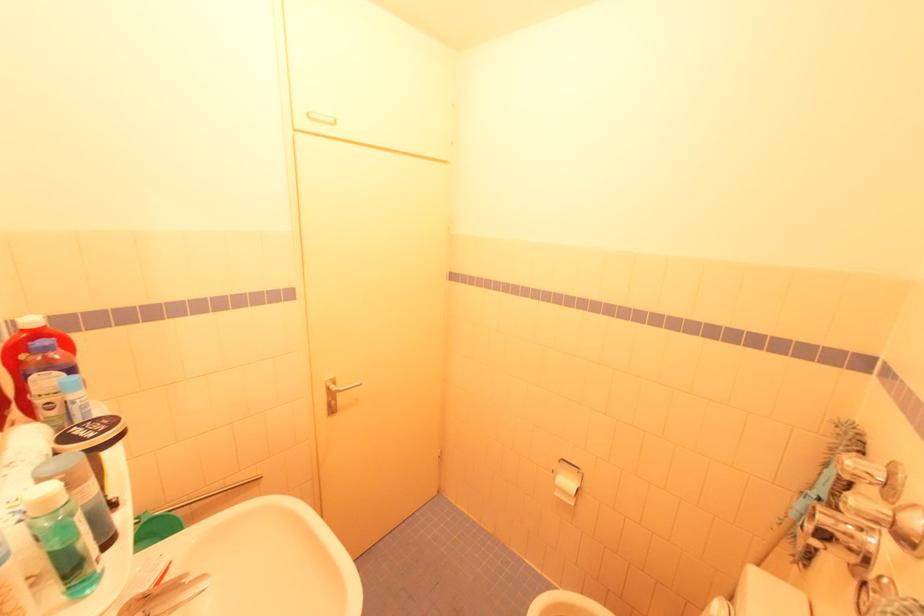
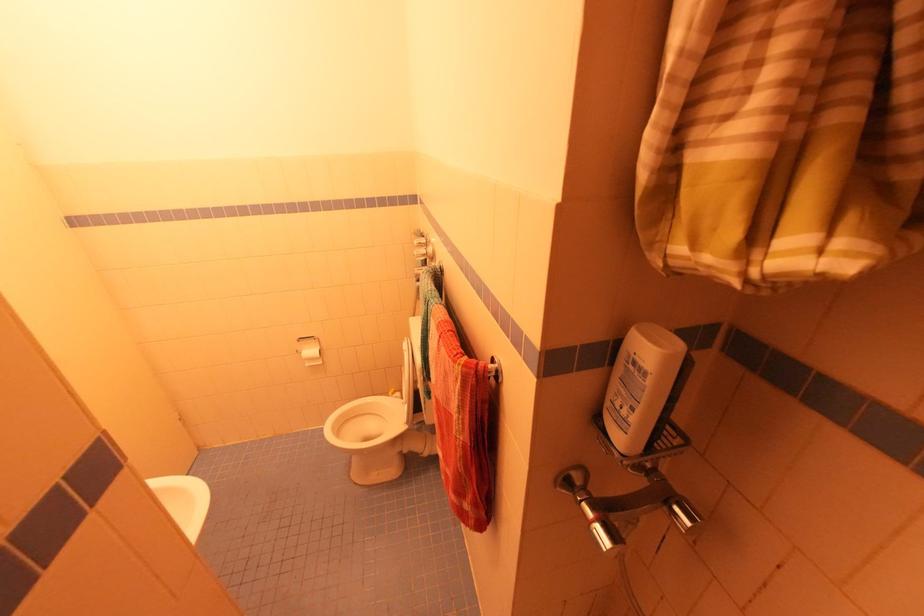
Find the pixel in the second image that matches [579,469] in the first image.

(314, 338)